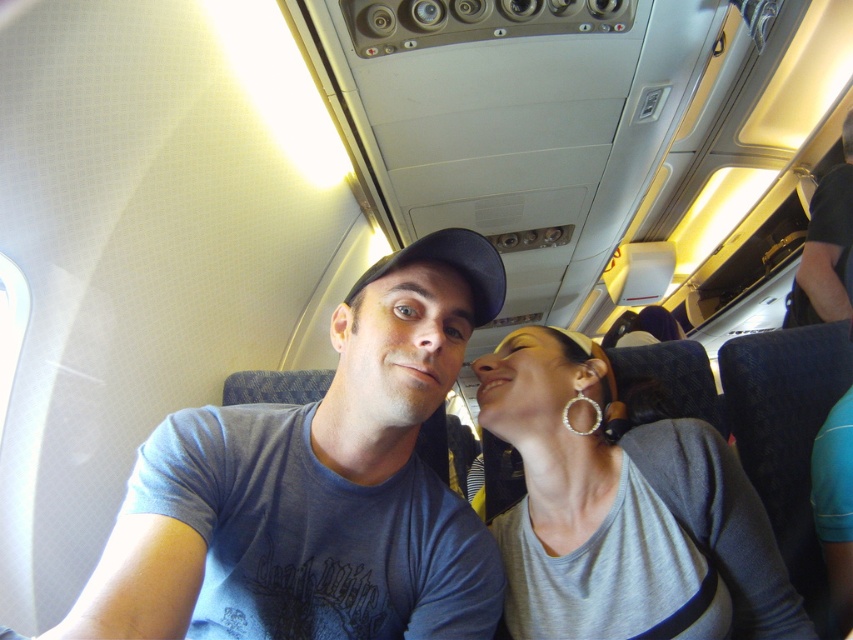
Question: Which object appears closest to the camera in this image?

Choices:
 (A) blue cotton t-shirt at center
 (B) gray matte shirt at upper right

Answer: (A)

Question: Is blue cotton t-shirt at center bigger than gray matte shirt at upper right?

Choices:
 (A) no
 (B) yes

Answer: (A)

Question: Can you confirm if blue cotton t-shirt at center is thinner than gray matte shirt at upper right?

Choices:
 (A) no
 (B) yes

Answer: (B)

Question: Which point appears farthest from the camera in this image?

Choices:
 (A) (357, 557)
 (B) (718, 484)

Answer: (B)

Question: Does blue cotton t-shirt at center come in front of gray matte shirt at upper right?

Choices:
 (A) no
 (B) yes

Answer: (B)